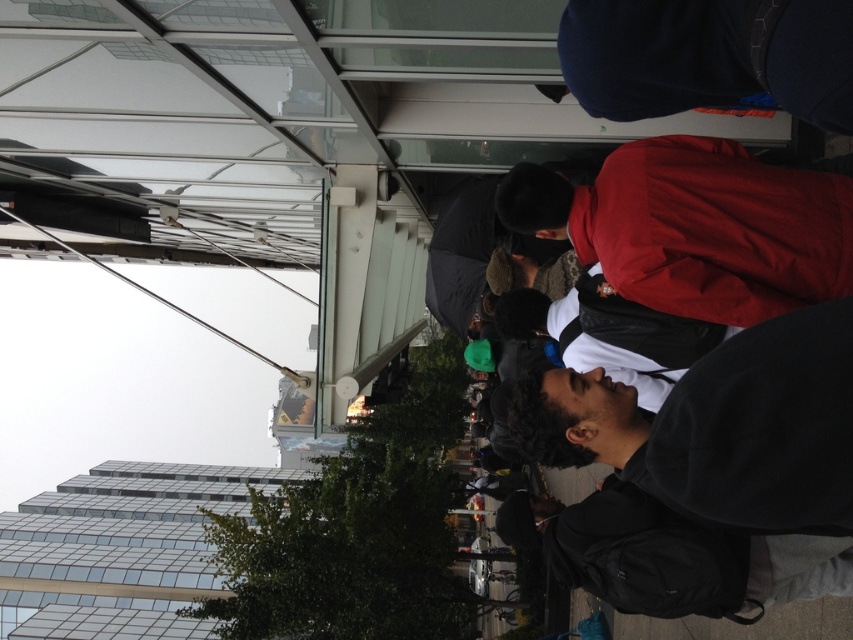
Who is more forward, (x=821, y=172) or (x=596, y=500)?

Point (x=821, y=172) is in front.

Which is above, red matte jacket at center or dark gray backpack at center?

red matte jacket at center is higher up.

Identify the location of red matte jacket at center. This screenshot has width=853, height=640. (695, 227).

I want to click on red matte jacket at center, so click(695, 227).

Between point (711, 385) and point (838, 220), which one is positioned in front?

Positioned in front is point (711, 385).

This screenshot has width=853, height=640. What are the coordinates of `black matte jacket at lower right` in the screenshot? It's located at (720, 428).

Which is more to the left, black matte jacket at lower right or dark gray backpack at center?

Positioned to the left is dark gray backpack at center.

What do you see at coordinates (720, 428) in the screenshot? I see `black matte jacket at lower right` at bounding box center [720, 428].

Between point (788, 406) and point (740, 604), which one is positioned behind?

Point (740, 604)

Where is `black matte jacket at lower right`? The image size is (853, 640). black matte jacket at lower right is located at coordinates (720, 428).